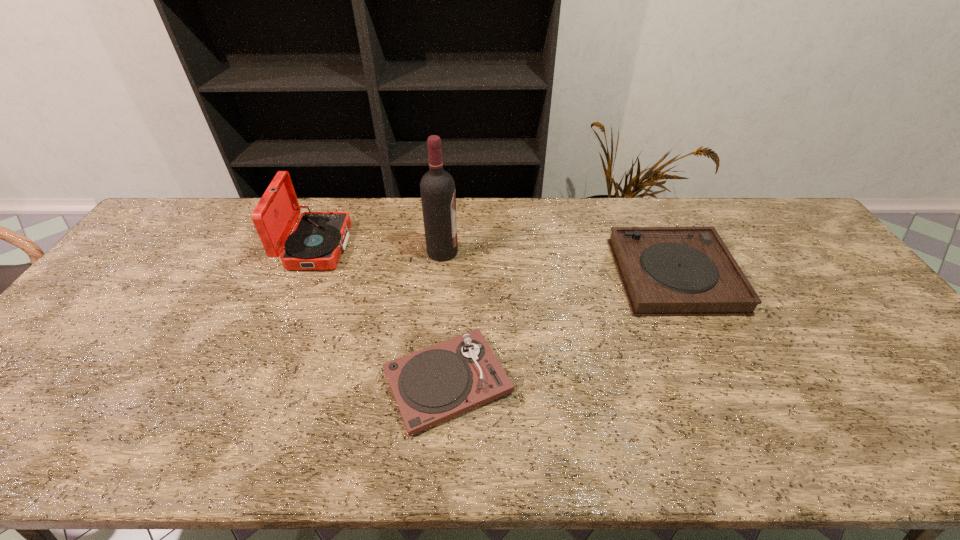
At what (x,y) coordinates should I click in order to perform the action: click on wine bottle. Please return your answer as a coordinate pair (x, y). This screenshot has height=540, width=960. Looking at the image, I should click on (437, 187).

The image size is (960, 540). I want to click on the second tallest object, so click(316, 243).

The height and width of the screenshot is (540, 960). Find the location of `the leftmost object`. the leftmost object is located at coordinates (316, 243).

The image size is (960, 540). I want to click on the rightmost phonograph_record, so click(x=666, y=271).

The width and height of the screenshot is (960, 540). I want to click on the second phonograph_record from left to right, so click(x=432, y=385).

You are a GUI agent. You are given a task and a screenshot of the screen. Output one action in this format:
    pyautogui.click(x=<x>, y=<y>)
    Task: Click on the nearest phonograph_record
    The width and height of the screenshot is (960, 540).
    Given the screenshot: What is the action you would take?
    pyautogui.click(x=432, y=385)

The width and height of the screenshot is (960, 540). What are the coordinates of `free location located on the label of the wine bottle` in the screenshot? It's located at (550, 252).

The width and height of the screenshot is (960, 540). What are the coordinates of `vacant space positioned 0.050m on the front-facing side of the third shortest object` in the screenshot? It's located at (364, 247).

Where is `vacant space located 0.350m on the left of the rightmost phonograph_record`? Image resolution: width=960 pixels, height=540 pixels. vacant space located 0.350m on the left of the rightmost phonograph_record is located at coordinates (501, 275).

Identify the location of vacant space located on the left of the nearest phonograph_record. The height and width of the screenshot is (540, 960). [x=234, y=382].